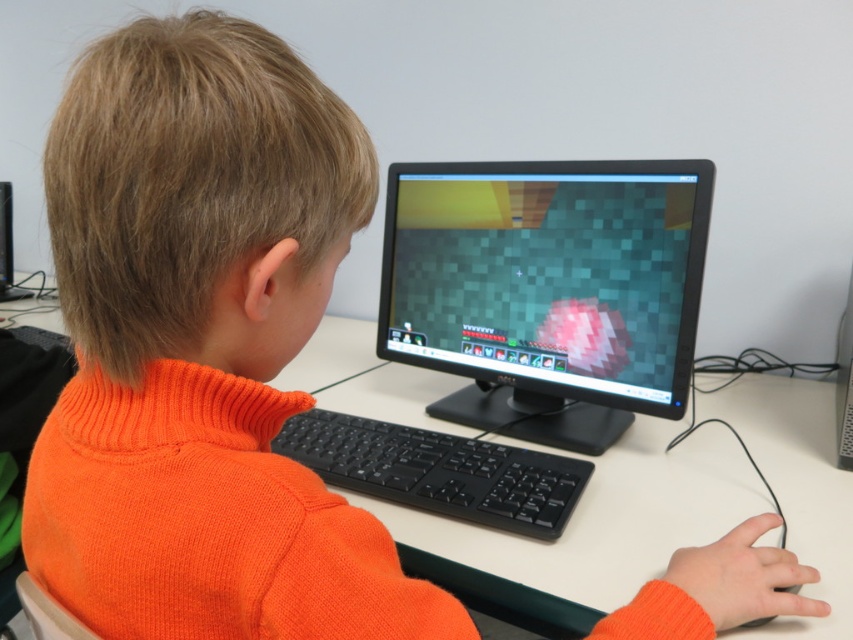
You are a delivery robot that needs to place a package on the desk. The desk has a black glossy monitor at center and a black plastic keyboard at center. According to the scene, which object is closer to you so you can place the package in front of it?

The black glossy monitor at center is closer to you than the black plastic keyboard at center, so you can place the package in front of the black glossy monitor at center.

You are setting up a new desk setup and want to place a mousepad between the black glossy monitor at center and the black plastic keyboard at center. Since the monitor is taller than the keyboard, which object should you place the mousepad closer to to ensure it doesn

The black glossy monitor at center is taller than the black plastic keyboard at center, so you should place the mousepad closer to the black plastic keyboard at center to ensure it is level with the keyboard.

You are setting up a new desk setup and want to place the black glossy monitor at center and the black plastic keyboard at center. Given their sizes, which object should be placed first to ensure proper positioning?

The black glossy monitor at center should be placed first since its width is greater than the black plastic keyboard at center, ensuring there is enough space for the wider monitor before positioning the keyboard.